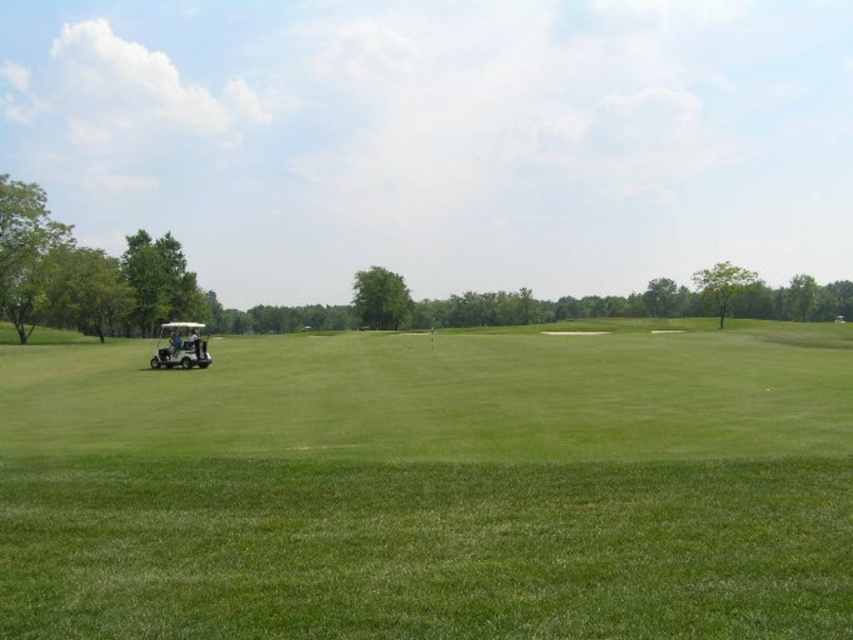
You are a golfer standing at the edge of the green smooth grass at center and want to drive your golf ball towards the white matte golf cart at left. Considering the space available, do you think the golf ball will have enough room to reach the cart without hitting any obstacles?

The green smooth grass at center has a larger width than the white matte golf cart at left, so the golf ball should have enough space to reach the cart without obstacles.

Looking at this image, you are a golfer planning to walk from the green smooth grass at center to the white matte golf cart at left. Which surface will you step onto first?

You will step onto the green smooth grass at center first because it is larger in size compared to the white matte golf cart at left, making it more accessible.

You are a golfer standing at the edge of the green smooth grass at center and want to reach the white matte golf cart at left. Which direction should you move to get there?

The green smooth grass at center is located below the white matte golf cart at left, so you should move upward to reach the white matte golf cart at left from the green smooth grass at center.